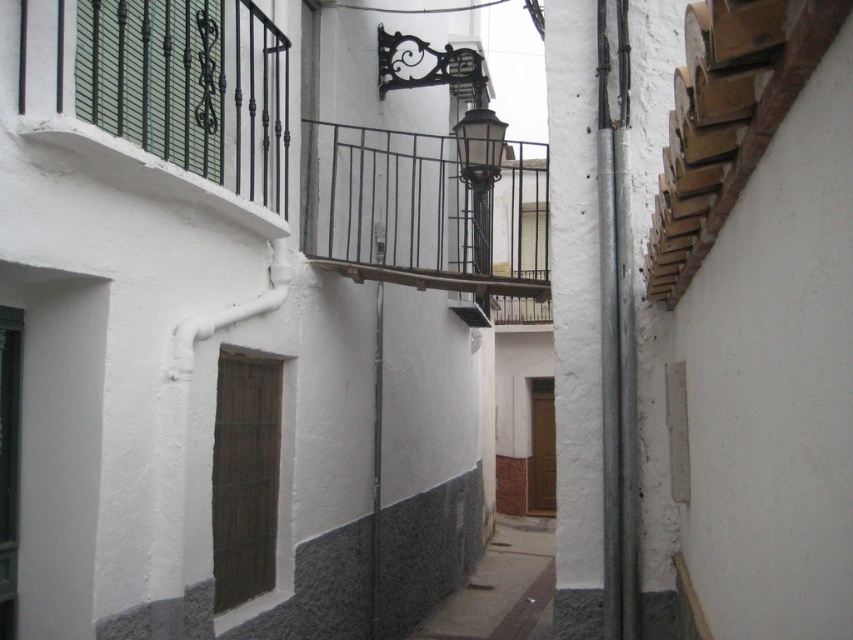
Between black wrought iron balcony at upper left and black wrought iron balcony at upper center, which one is positioned lower?

black wrought iron balcony at upper left is below.

Is black wrought iron balcony at upper left positioned before black wrought iron balcony at upper center?

Yes, it is.

Find the location of a particular element. black wrought iron balcony at upper left is located at coordinates (166, 96).

Who is lower down, black wrought iron balcony at upper center or brown wooden tiles at upper right?

brown wooden tiles at upper right

Between point (303, 147) and point (718, 202), which one is positioned in front?

Point (718, 202) is in front.

Which is in front, point (413, 253) or point (798, 56)?

Positioned in front is point (798, 56).

Where is `black wrought iron balcony at upper center`? Image resolution: width=853 pixels, height=640 pixels. black wrought iron balcony at upper center is located at coordinates [422, 211].

Does black wrought iron balcony at upper left have a greater width compared to brown wooden tiles at upper right?

Incorrect, black wrought iron balcony at upper left's width does not surpass brown wooden tiles at upper right's.

Does black wrought iron balcony at upper left have a larger size compared to brown wooden tiles at upper right?

Yes, black wrought iron balcony at upper left is bigger than brown wooden tiles at upper right.

The image size is (853, 640). I want to click on black wrought iron balcony at upper left, so click(166, 96).